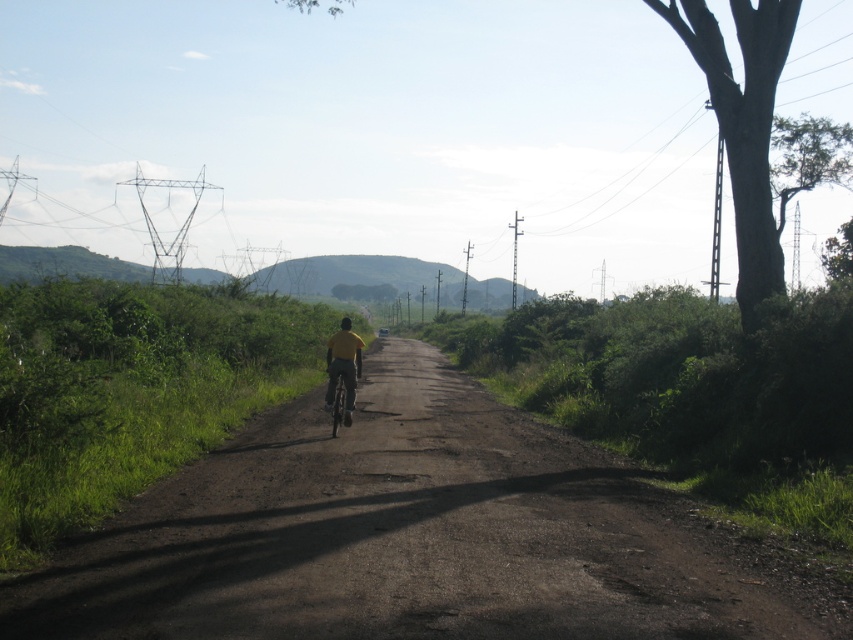
Question: Can you confirm if dirt road at center is wider than yellow fabric at center?

Choices:
 (A) no
 (B) yes

Answer: (B)

Question: Which point appears closest to the camera in this image?

Choices:
 (A) (349, 408)
 (B) (294, 474)

Answer: (B)

Question: Does dirt road at center appear under yellow fabric at center?

Choices:
 (A) no
 (B) yes

Answer: (B)

Question: Considering the real-world distances, which object is closest to the dirt road at center?

Choices:
 (A) yellow fabric at center
 (B) metallic silver bicycle at center

Answer: (B)

Question: Is dirt road at center below yellow fabric at center?

Choices:
 (A) no
 (B) yes

Answer: (B)

Question: Estimate the real-world distances between objects in this image. Which object is farther from the dirt road at center?

Choices:
 (A) yellow fabric at center
 (B) metallic silver bicycle at center

Answer: (A)